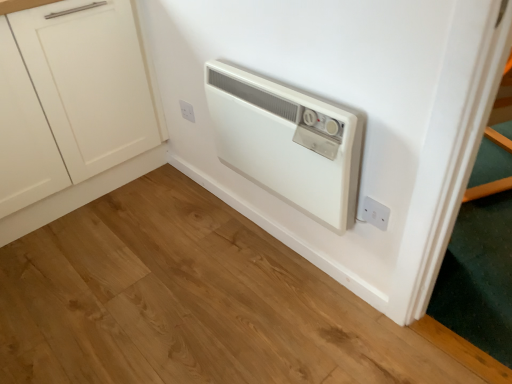
Question: In terms of height, does white plastic electric outlet at upper center, which is counted as the first electric outlet, starting from the back, look taller or shorter compared to white plastic heater at center?

Choices:
 (A) short
 (B) tall

Answer: (A)

Question: Is white plastic electric outlet at upper center, arranged as the second electric outlet when viewed from the right, bigger or smaller than white plastic heater at center?

Choices:
 (A) small
 (B) big

Answer: (A)

Question: Considering the real-world distances, which object is closest to the white matte cabinet at left?

Choices:
 (A) white plastic electric outlet at lower right, which is counted as the second electric outlet, starting from the back
 (B) white plastic heater at center
 (C) white plastic electric outlet at upper center, which is counted as the 2th electric outlet, starting from the bottom

Answer: (C)

Question: Which object is the farthest from the white plastic heater at center?

Choices:
 (A) white matte cabinet at left
 (B) white plastic electric outlet at lower right, the 1th electric outlet in the front-to-back sequence
 (C) white plastic electric outlet at upper center, positioned as the 1th electric outlet in top-to-bottom order

Answer: (A)